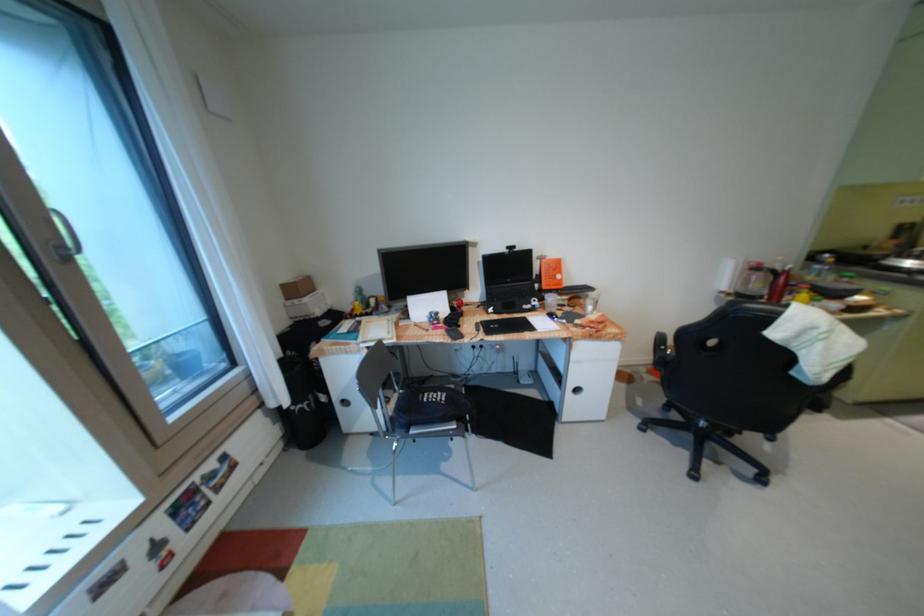
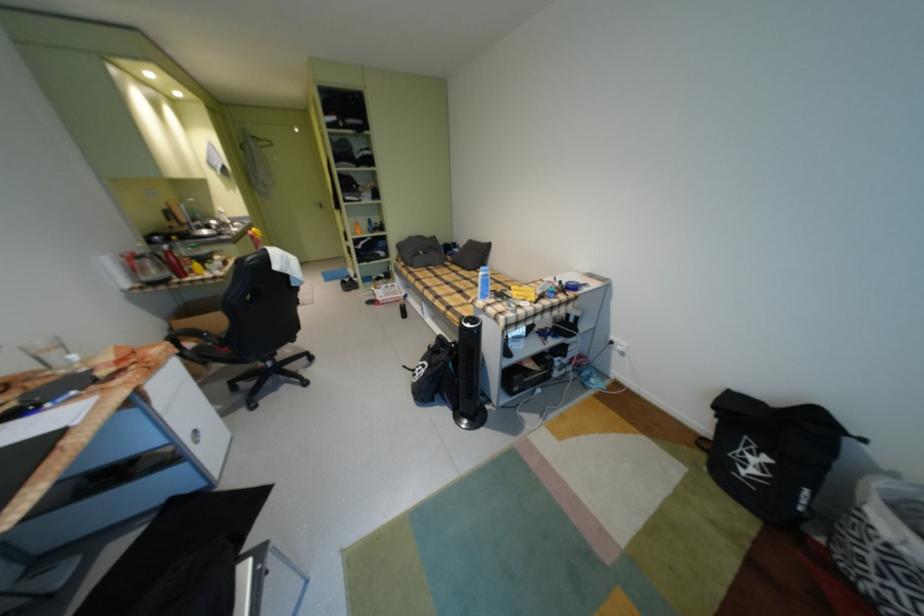
In the scene shown: How did the camera likely rotate?

The camera rotated toward right-down.